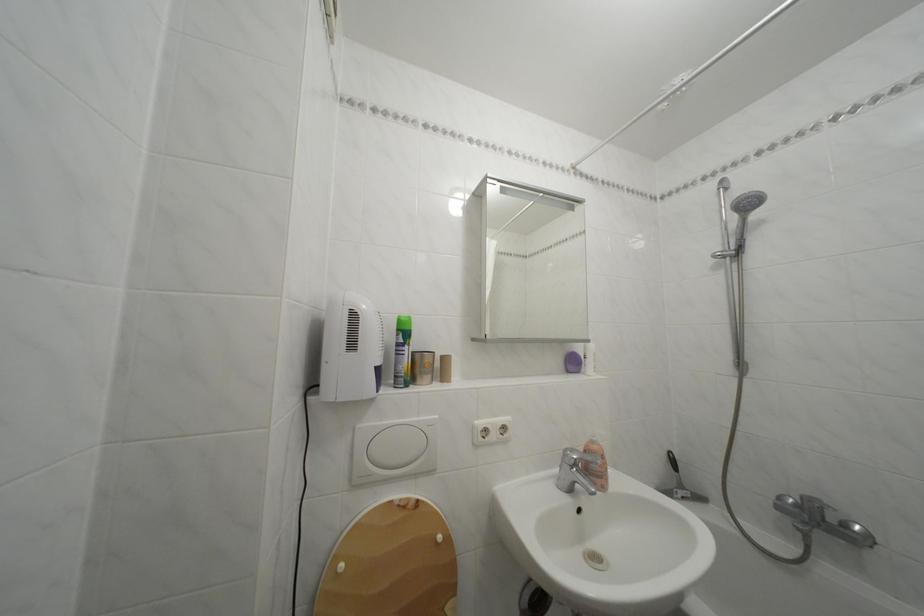
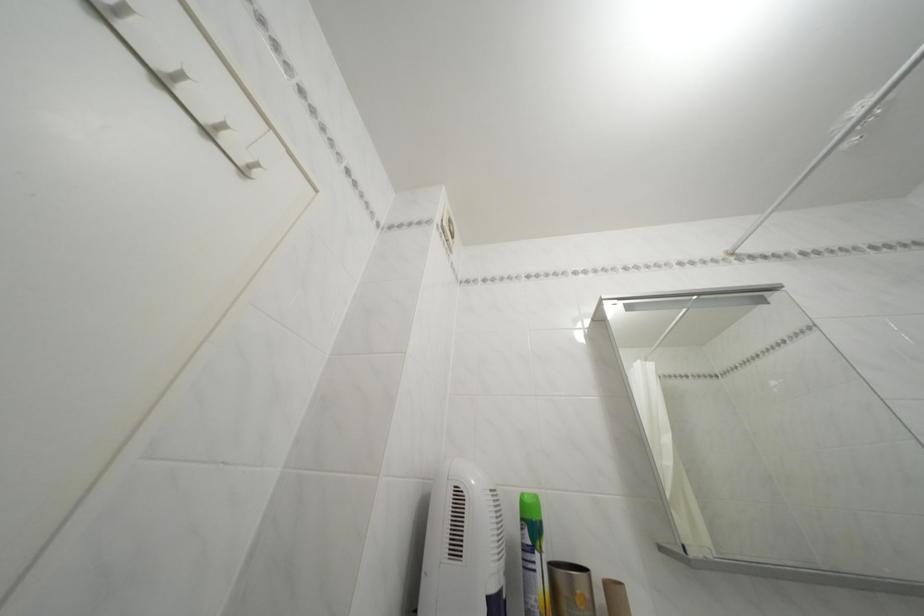
The point at (407, 336) is marked in the first image. Where is the corresponding point in the second image?

(531, 525)